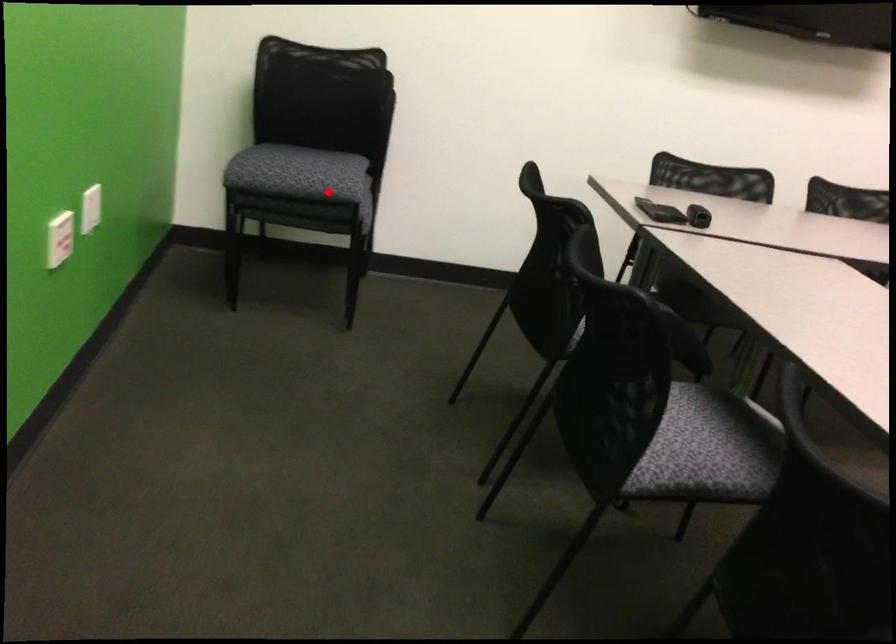
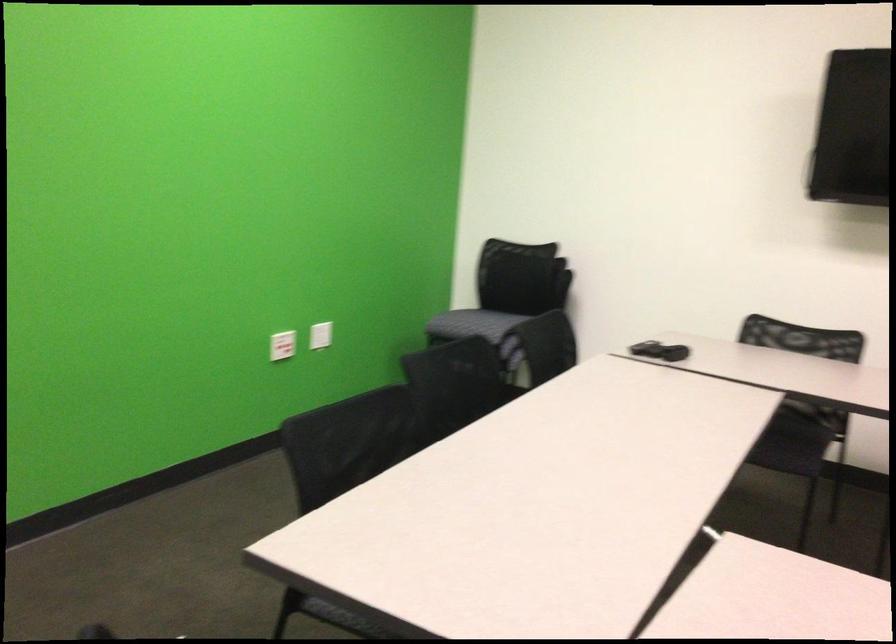
Where in the second image is the point corresponding to the highlighted location from the first image?

(471, 324)